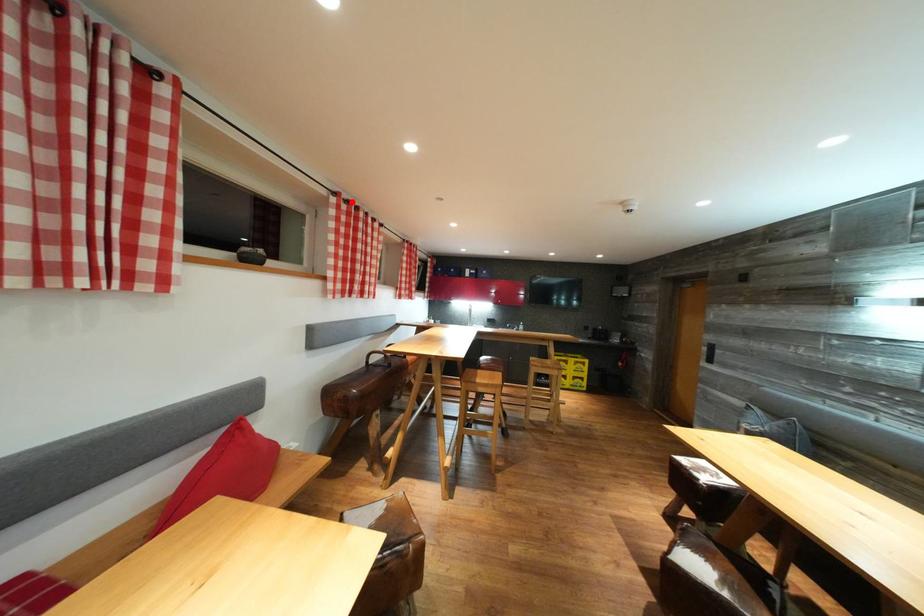
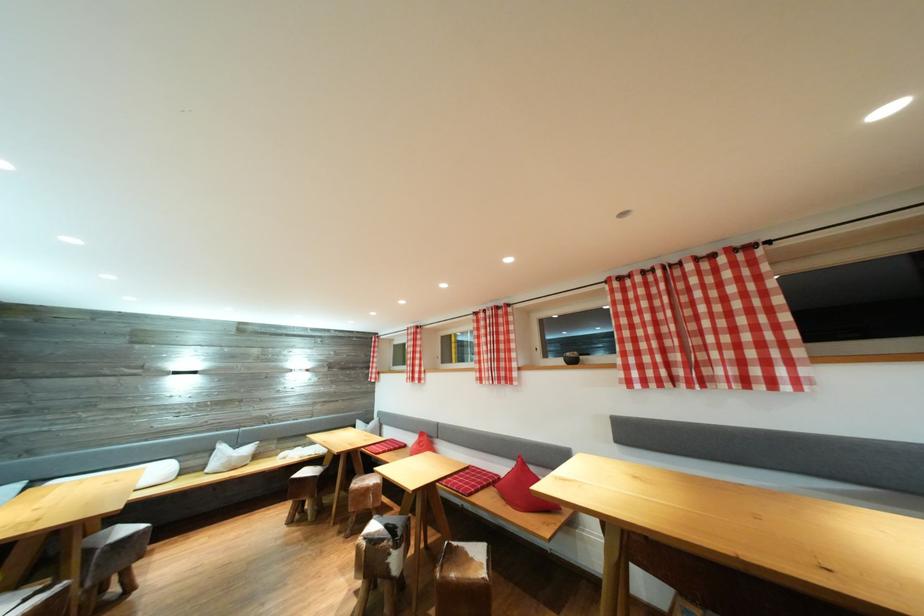
Find the pixel in the second image that matches the highlighted location in the first image.

(631, 278)